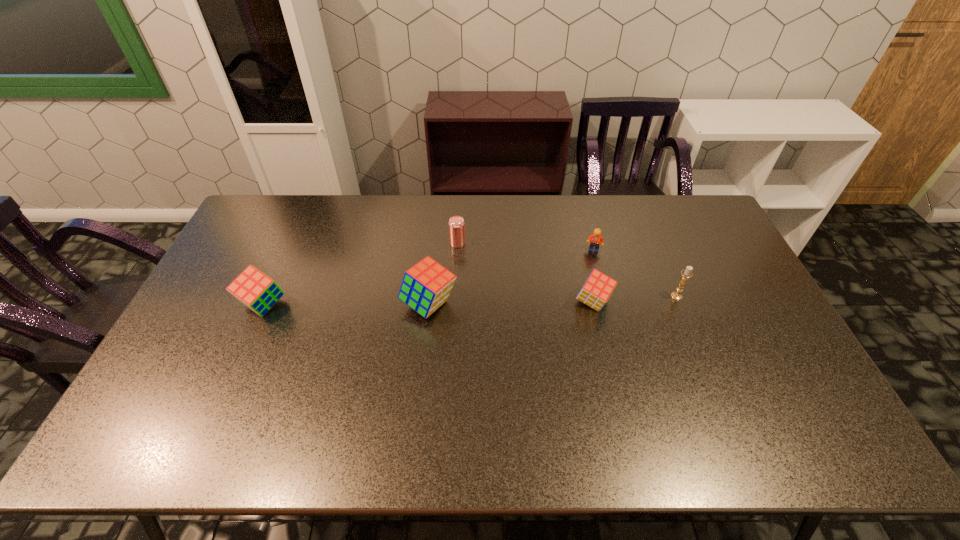
The height and width of the screenshot is (540, 960). What are the coordinates of `free spot located 0.230m on the front-facing side of the Lego` in the screenshot? It's located at (608, 305).

You are a GUI agent. You are given a task and a screenshot of the screen. Output one action in this format:
    pyautogui.click(x=<x>, y=<y>)
    Task: Click on the vacant space located 0.050m on the front of the beer can
    This screenshot has height=540, width=960.
    Given the screenshot: What is the action you would take?
    pyautogui.click(x=457, y=258)

Identify the location of vacant space situated on the right of the rightmost object. (705, 296).

Locate an element on the screen. object that is positioned at the left edge is located at coordinates (254, 289).

Locate an element on the screen. vacant space at the far edge is located at coordinates (427, 219).

At what (x,y) coordinates should I click in order to perform the action: click on vacant space at the near edge. Please return your answer as a coordinate pair (x, y). This screenshot has width=960, height=540. Looking at the image, I should click on (447, 389).

Where is `vacant space at the left edge of the desktop`? This screenshot has width=960, height=540. vacant space at the left edge of the desktop is located at coordinates (186, 331).

The image size is (960, 540). In the image, there is a desktop. In order to click on vacant space at the right edge in this screenshot , I will do `click(734, 264)`.

You are a GUI agent. You are given a task and a screenshot of the screen. Output one action in this format:
    pyautogui.click(x=<x>, y=<y>)
    Task: Click on the blank area at the far left corner
    
    Given the screenshot: What is the action you would take?
    pyautogui.click(x=271, y=201)

At what (x,y) coordinates should I click in order to perform the action: click on blank area at the near left corner. Please return your answer as a coordinate pair (x, y). Looking at the image, I should click on (206, 396).